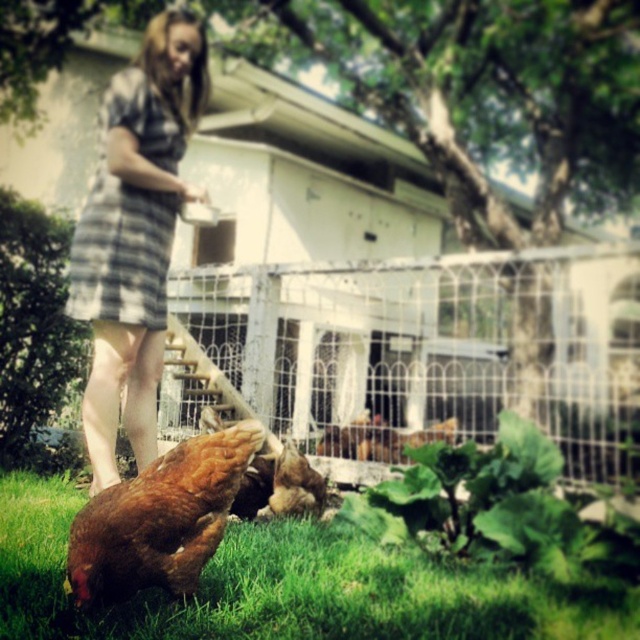
You are standing at the entrance of the yard and want to reach the chickens in the lower left corner. The wire mesh fence at center might block your path. Can you walk around the fence to get to the chickens?

The wire mesh fence at center is located at point (429, 346), so you can walk around it to reach the chickens in the lower left corner.

You are standing in the outdoor scene and want to place a small decoration between the two points, point (176, 301) and point (320, 477). Which point is closer to you where you should start placing the decoration?

Point (176, 301) is closer to you, so you should start placing the decoration near that point first.

You are standing at the position of the woman and want to throw a seed to the chickens. There are two points marked in the scene, point A at coordinates point [154,275] and point B at coordinates point [209,504]. Which point is closer to you, the woman, so you can throw the seed accurately?

Point A at coordinates point [154,275] is closer to you because it is further to the camera than point B at coordinates point [209,504], meaning it is physically nearer in the scene.